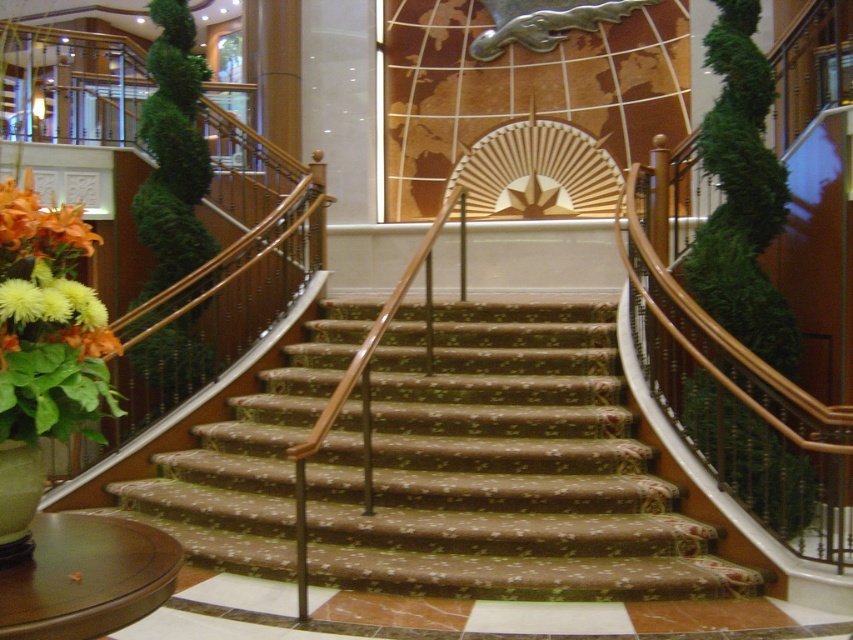
Question: Considering the real-world distances, which object is closest to the brown textured carpet at center?

Choices:
 (A) yellow matte flower at lower left
 (B) orange matte flower at lower left

Answer: (A)

Question: Does brown textured carpet at center have a smaller size compared to orange matte flower at lower left?

Choices:
 (A) yes
 (B) no

Answer: (B)

Question: Is brown textured carpet at center to the left of yellow matte flower at lower left from the viewer's perspective?

Choices:
 (A) yes
 (B) no

Answer: (B)

Question: Which point is closer to the camera?

Choices:
 (A) (30, 202)
 (B) (4, 228)
 (C) (225, 438)

Answer: (B)

Question: Does brown textured carpet at center appear on the right side of orange matte flower at lower left?

Choices:
 (A) yes
 (B) no

Answer: (A)

Question: Which object appears closest to the camera in this image?

Choices:
 (A) orange matte flower at lower left
 (B) yellow matte flower at lower left
 (C) brown textured carpet at center

Answer: (B)